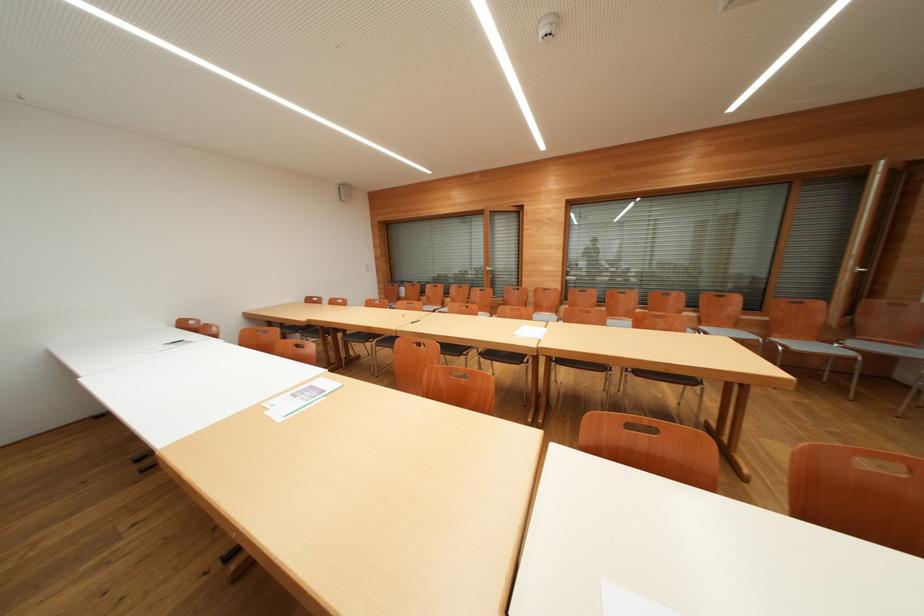
Locate an element on the screen. The image size is (924, 616). paper document is located at coordinates (530, 331).